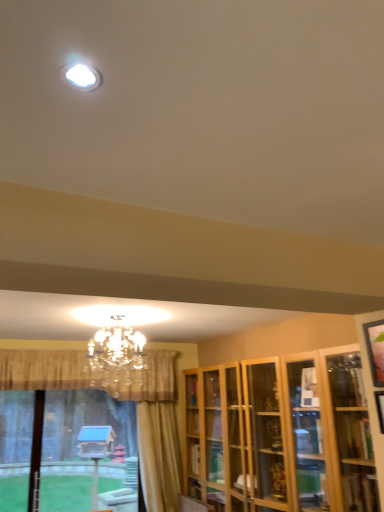
Describe the element at coordinates (380, 408) in the screenshot. The image size is (384, 512). I see `wooden picture frame at right, acting as the 2th picture frame starting from the top` at that location.

This screenshot has height=512, width=384. Describe the element at coordinates (375, 350) in the screenshot. I see `wooden picture frame at upper right, which is counted as the first picture frame, starting from the top` at that location.

Where is `white glossy light fixture at upper center`? The height and width of the screenshot is (512, 384). white glossy light fixture at upper center is located at coordinates (81, 76).

What is the approximate width of crystal chandelier at upper center?

crystal chandelier at upper center is 17.95 inches wide.

I want to click on crystal chandelier at upper center, so click(x=119, y=359).

Locate an element on the screen. Image resolution: width=384 pixels, height=512 pixels. wooden cabinet at right is located at coordinates coord(281,434).

Image resolution: width=384 pixels, height=512 pixels. What are the coordinates of `wooden picture frame at right, acting as the 2th picture frame starting from the top` in the screenshot? It's located at (380, 408).

In the image, is translucent glass bay window at lower left positioned in front of or behind white glossy light fixture at upper center?

translucent glass bay window at lower left is behind white glossy light fixture at upper center.

Looking at this image, which is closer, (129, 460) or (68, 67)?

Point (129, 460) is farther from the camera than point (68, 67).

From a real-world perspective, is translucent glass bay window at lower left physically above white glossy light fixture at upper center?

No, from a real-world perspective, translucent glass bay window at lower left is not over white glossy light fixture at upper center

What's the angular difference between crystal chandelier at upper center and wooden picture frame at upper right, which is counted as the first picture frame, starting from the top,'s facing directions?

There is a 89.7-degree angle between the facing directions of crystal chandelier at upper center and wooden picture frame at upper right, which is counted as the first picture frame, starting from the top.

From the image's perspective, which is below, crystal chandelier at upper center or wooden picture frame at upper right, marked as the 2th picture frame in a bottom-to-top arrangement?

crystal chandelier at upper center is shown below in the image.

Does point (138, 394) come closer to viewer compared to point (373, 354)?

No, (138, 394) is further to viewer.

Is crystal chandelier at upper center turned away from wooden picture frame at upper right, marked as the 2th picture frame in a bottom-to-top arrangement?

No, wooden picture frame at upper right, marked as the 2th picture frame in a bottom-to-top arrangement, is not at the back of crystal chandelier at upper center.

Is wooden cabinet at right located within wooden picture frame at upper right, which is counted as the first picture frame, starting from the top?

No, wooden cabinet at right is not a part of wooden picture frame at upper right, which is counted as the first picture frame, starting from the top.

Considering the sizes of objects wooden picture frame at upper right, which is counted as the first picture frame, starting from the top, and wooden cabinet at right in the image provided, who is bigger, wooden picture frame at upper right, which is counted as the first picture frame, starting from the top, or wooden cabinet at right?

wooden cabinet at right.

Does wooden picture frame at upper right, which is counted as the first picture frame, starting from the top, have a greater height compared to wooden cabinet at right?

Incorrect, the height of wooden picture frame at upper right, which is counted as the first picture frame, starting from the top, is not larger of that of wooden cabinet at right.

Starting from the wooden cabinet at right, which picture frame is the 2nd one to the left? Please provide its 2D coordinates.

[(375, 350)]

How different are the orientations of white glossy light fixture at upper center and crystal chandelier at upper center in degrees?

The angle between the facing direction of white glossy light fixture at upper center and the facing direction of crystal chandelier at upper center is 0.00443 degrees.

From a real-world perspective, is white glossy light fixture at upper center physically above crystal chandelier at upper center?

Correct, in the physical world, white glossy light fixture at upper center is higher than crystal chandelier at upper center.

Is point (96, 82) in front of point (141, 388)?

Yes, point (96, 82) is closer to viewer.

Relative to crystal chandelier at upper center, is white glossy light fixture at upper center in front or behind?

In the image, white glossy light fixture at upper center appears in front of crystal chandelier at upper center.

Who is taller, white glossy light fixture at upper center or translucent glass bay window at lower left?

translucent glass bay window at lower left is taller.

Which of these two, white glossy light fixture at upper center or translucent glass bay window at lower left, is smaller?

white glossy light fixture at upper center.

How many degrees apart are the facing directions of white glossy light fixture at upper center and translucent glass bay window at lower left?

0.328 degrees separate the facing orientations of white glossy light fixture at upper center and translucent glass bay window at lower left.

Is white glossy light fixture at upper center behind translucent glass bay window at lower left?

No, white glossy light fixture at upper center is closer to the viewer.

Which is in front, wooden cabinet at right or white glossy light fixture at upper center?

white glossy light fixture at upper center is more forward.

Who is smaller, wooden cabinet at right or white glossy light fixture at upper center?

white glossy light fixture at upper center.

Who is shorter, wooden cabinet at right or white glossy light fixture at upper center?

Standing shorter between the two is white glossy light fixture at upper center.

From the image's perspective, which one is positioned higher, wooden cabinet at right or white glossy light fixture at upper center?

white glossy light fixture at upper center appears higher in the image.

The image size is (384, 512). I want to click on lighting that appears in front of the crystal chandelier at upper center, so click(81, 76).

Would you say crystal chandelier at upper center is outside white glossy light fixture at upper center?

Yes.

Which is behind, crystal chandelier at upper center or white glossy light fixture at upper center?

crystal chandelier at upper center is further away from the camera.

From the image's perspective, is crystal chandelier at upper center below white glossy light fixture at upper center?

Yes.

Locate an element on the screen. lighting in front of the translucent glass bay window at lower left is located at coordinates (81, 76).

Where is `the 1st picture frame below the crystal chandelier at upper center (from a real-world perspective)`? This screenshot has width=384, height=512. the 1st picture frame below the crystal chandelier at upper center (from a real-world perspective) is located at coordinates (375, 350).

Considering their positions, is wooden picture frame at right, acting as the 2th picture frame starting from the top, positioned further to translucent glass bay window at lower left than white glossy light fixture at upper center?

white glossy light fixture at upper center is positioned further to the anchor translucent glass bay window at lower left.

Looking at the image, which one is located further to white glossy light fixture at upper center, crystal chandelier at upper center or wooden picture frame at right, which is the first picture frame from bottom to top?

The object further to white glossy light fixture at upper center is crystal chandelier at upper center.

When comparing their distances from wooden picture frame at upper right, which is counted as the first picture frame, starting from the top, does white glossy light fixture at upper center or crystal chandelier at upper center seem further?

The object further to wooden picture frame at upper right, which is counted as the first picture frame, starting from the top, is crystal chandelier at upper center.

When comparing their distances from wooden picture frame at upper right, marked as the 2th picture frame in a bottom-to-top arrangement, does wooden picture frame at right, acting as the 2th picture frame starting from the top, or crystal chandelier at upper center seem further?

The object further to wooden picture frame at upper right, marked as the 2th picture frame in a bottom-to-top arrangement, is crystal chandelier at upper center.

Looking at the image, which one is located closer to crystal chandelier at upper center, wooden picture frame at right, acting as the 2th picture frame starting from the top, or wooden cabinet at right?

wooden cabinet at right.

Estimate the real-world distances between objects in this image. Which object is further from white glossy light fixture at upper center, crystal chandelier at upper center or wooden picture frame at upper right, marked as the 2th picture frame in a bottom-to-top arrangement?

The object further to white glossy light fixture at upper center is crystal chandelier at upper center.

Based on their spatial positions, is translucent glass bay window at lower left or wooden picture frame at right, acting as the 2th picture frame starting from the top, further from crystal chandelier at upper center?

The object further to crystal chandelier at upper center is wooden picture frame at right, acting as the 2th picture frame starting from the top.

When comparing their distances from translucent glass bay window at lower left, does white glossy light fixture at upper center or wooden cabinet at right seem further?

white glossy light fixture at upper center lies further to translucent glass bay window at lower left than the other object.

Locate an element on the screen. The height and width of the screenshot is (512, 384). picture frame between crystal chandelier at upper center and wooden picture frame at right, acting as the 2th picture frame starting from the top is located at coordinates (375, 350).

The width and height of the screenshot is (384, 512). I want to click on picture frame between translucent glass bay window at lower left and wooden picture frame at right, which is the first picture frame from bottom to top, so click(375, 350).

In order to click on picture frame situated between white glossy light fixture at upper center and wooden picture frame at right, which is the first picture frame from bottom to top, from left to right in this screenshot , I will do `click(375, 350)`.

You are a GUI agent. You are given a task and a screenshot of the screen. Output one action in this format:
    pyautogui.click(x=<x>, y=<y>)
    Task: Click on the lamp between translucent glass bay window at lower left and wooden cabinet at right from left to right
    
    Given the screenshot: What is the action you would take?
    pyautogui.click(x=119, y=359)